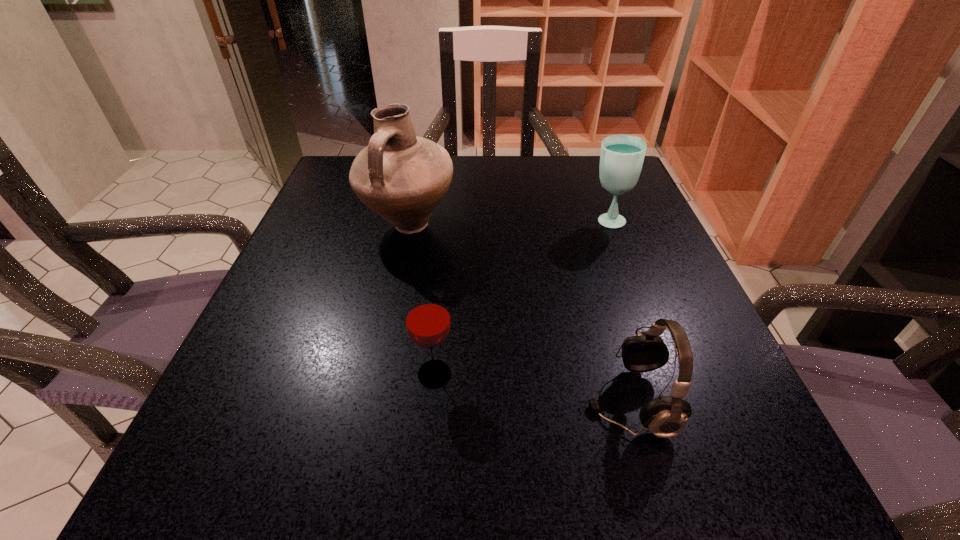
Locate an element on the screen. free space at the left edge of the desktop is located at coordinates (315, 335).

Image resolution: width=960 pixels, height=540 pixels. In the image, there is a desktop. In order to click on vacant space at the right edge in this screenshot , I will do point(592,233).

The height and width of the screenshot is (540, 960). In order to click on free space at the far left corner of the desktop in this screenshot , I will do `click(351, 165)`.

Locate an element on the screen. The width and height of the screenshot is (960, 540). vacant region at the near left corner is located at coordinates (246, 494).

The image size is (960, 540). In the image, there is a desktop. What are the coordinates of `vacant space at the far right corner` in the screenshot? It's located at (601, 187).

In order to click on vacant point at the near right corner in this screenshot , I will do `click(771, 491)`.

The width and height of the screenshot is (960, 540). In order to click on free space between the farther glass and the headset in this screenshot , I will do `click(617, 310)`.

You are a GUI agent. You are given a task and a screenshot of the screen. Output one action in this format:
    pyautogui.click(x=<x>, y=<y>)
    Task: Click on the vacant point located between the shorter glass and the right glass
    
    Given the screenshot: What is the action you would take?
    pyautogui.click(x=520, y=298)

Identify the location of free space between the right glass and the left glass. The height and width of the screenshot is (540, 960). (520, 298).

Identify the location of free space between the right glass and the left glass. (520, 298).